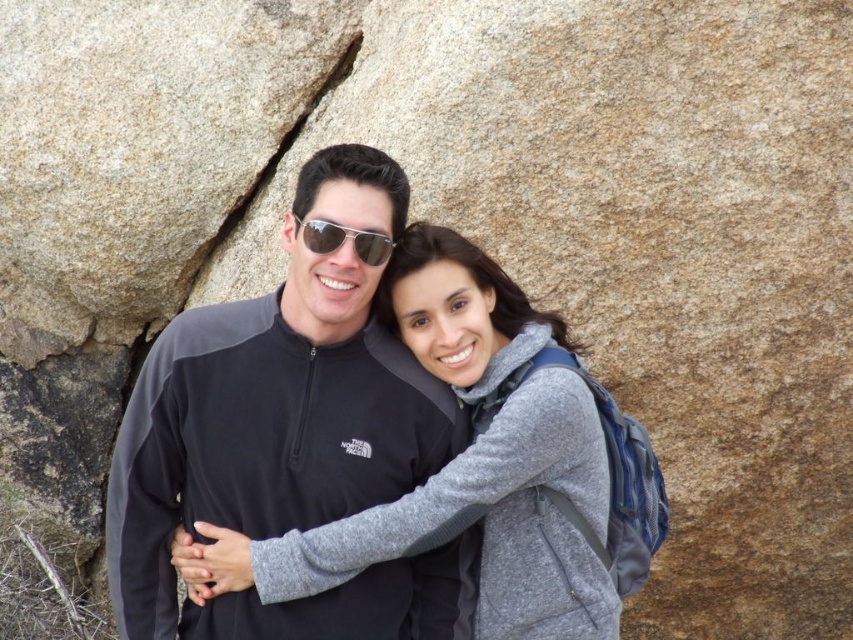
Does point (235, 394) come farther from viewer compared to point (360, 232)?

Yes, point (235, 394) is farther from viewer.

Who is more forward, (x=302, y=403) or (x=325, y=225)?

Point (x=325, y=225) is in front.

Is point (196, 625) behind point (335, 228)?

Yes, it is behind point (335, 228).

At what (x,y) coordinates should I click in order to perform the action: click on matte black jacket at center. Please return your answer as a coordinate pair (x, y). The width and height of the screenshot is (853, 640). Looking at the image, I should click on (289, 436).